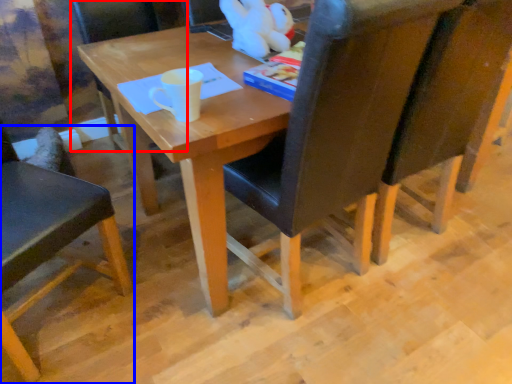
Question: Among these objects, which one is nearest to the camera, chair (highlighted by a red box) or chair (highlighted by a blue box)?

Choices:
 (A) chair
 (B) chair

Answer: (B)